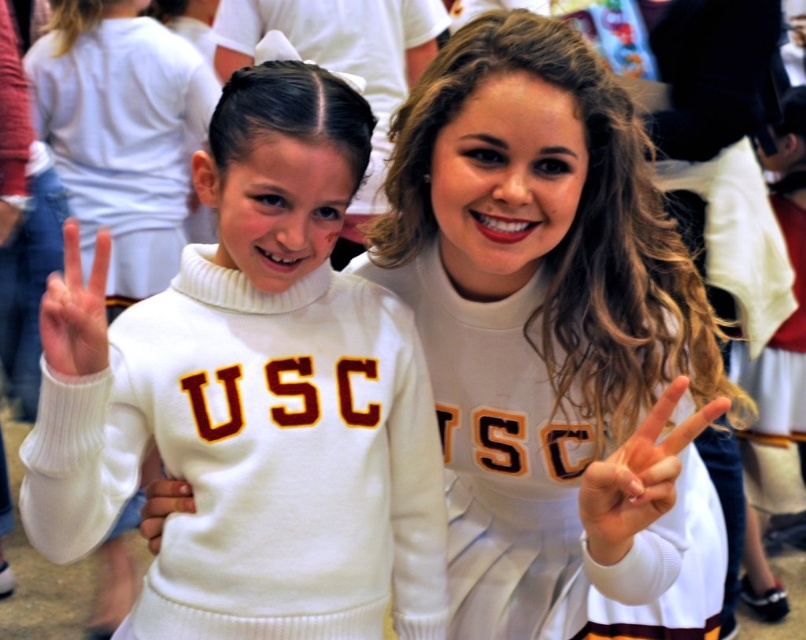
You are at a USC event and see two items in the image. One is the white turtleneck sweater at left and the other is the white soft hand at center. Which one is positioned to the right of the other?

The white turtleneck sweater at left is to the right of white soft hand at center.

You are a photographer trying to capture a group photo. You notice two white matte hands in the frame. The first is the white matte hand at left, and the second is the white matte hand at center. Which hand is positioned lower in the image?

The white matte hand at center is located below the white matte hand at left, so the hand at center is lower in the image.